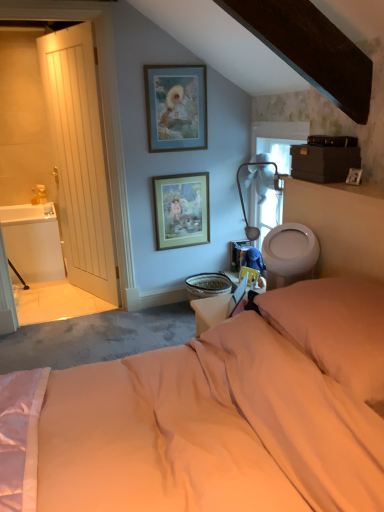
Question: Which direction should I rotate to look at wooden framed print at center, arranged as the first picture frame when ordered from the bottom?

Choices:
 (A) left
 (B) right

Answer: (A)

Question: From a real-world perspective, is wooden framed print at center, arranged as the first picture frame when ordered from the bottom, below white wooden door at left?

Choices:
 (A) no
 (B) yes

Answer: (B)

Question: Does wooden framed print at center, the 2th picture frame when ordered from top to bottom, appear on the right side of white wooden door at left?

Choices:
 (A) yes
 (B) no

Answer: (A)

Question: Does wooden framed print at center, arranged as the first picture frame when ordered from the bottom, come in front of white wooden door at left?

Choices:
 (A) no
 (B) yes

Answer: (A)

Question: Is wooden framed print at center, the 2th picture frame when ordered from top to bottom, shorter than white wooden door at left?

Choices:
 (A) no
 (B) yes

Answer: (B)

Question: Does wooden framed print at center, the 2th picture frame when ordered from top to bottom, come behind white wooden door at left?

Choices:
 (A) no
 (B) yes

Answer: (B)

Question: Does wooden framed print at center, the 2th picture frame when ordered from top to bottom, have a greater height compared to white wooden door at left?

Choices:
 (A) yes
 (B) no

Answer: (B)

Question: Does wooden framed print at center, arranged as the first picture frame when ordered from the bottom, have a lesser width compared to blue matte picture frame at upper center, which is the 2th picture frame in bottom-to-top order?

Choices:
 (A) yes
 (B) no

Answer: (B)

Question: Is wooden framed print at center, arranged as the first picture frame when ordered from the bottom, in contact with blue matte picture frame at upper center, which ranks as the first picture frame in top-to-bottom order?

Choices:
 (A) no
 (B) yes

Answer: (A)

Question: Is wooden framed print at center, the 2th picture frame when ordered from top to bottom, turned away from blue matte picture frame at upper center, which is the 2th picture frame in bottom-to-top order?

Choices:
 (A) no
 (B) yes

Answer: (A)

Question: Is wooden framed print at center, the 2th picture frame when ordered from top to bottom, positioned before blue matte picture frame at upper center, which is the 2th picture frame in bottom-to-top order?

Choices:
 (A) yes
 (B) no

Answer: (B)

Question: Is wooden framed print at center, the 2th picture frame when ordered from top to bottom, oriented towards blue matte picture frame at upper center, which ranks as the first picture frame in top-to-bottom order?

Choices:
 (A) yes
 (B) no

Answer: (B)

Question: Does wooden framed print at center, the 2th picture frame when ordered from top to bottom, lie behind blue matte picture frame at upper center, which ranks as the first picture frame in top-to-bottom order?

Choices:
 (A) no
 (B) yes

Answer: (B)

Question: Does white glossy sink at left appear on the left side of white fabric lampshade at upper center?

Choices:
 (A) yes
 (B) no

Answer: (A)